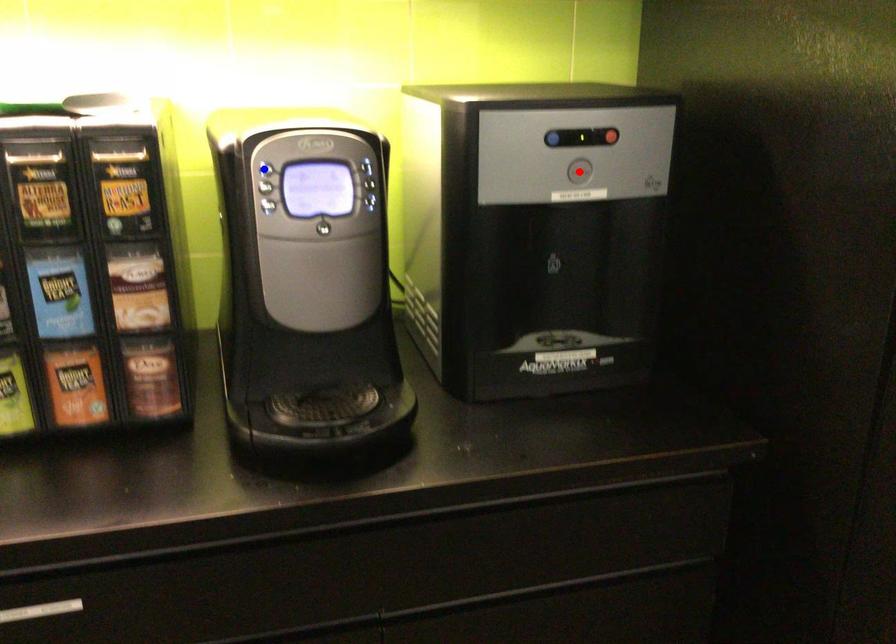
Question: Which of the two points in the image is closer to the camera?

Choices:
 (A) Blue point is closer.
 (B) Red point is closer.

Answer: (A)